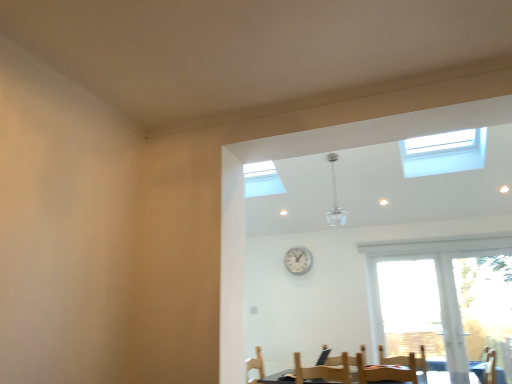
Question: Is silver metallic clock at center smaller than wooden chair at lower center?

Choices:
 (A) yes
 (B) no

Answer: (A)

Question: Could you tell me if silver metallic clock at center is turned towards wooden chair at lower center?

Choices:
 (A) yes
 (B) no

Answer: (B)

Question: Is silver metallic clock at center far away from wooden chair at lower center?

Choices:
 (A) yes
 (B) no

Answer: (A)

Question: Is wooden chair at lower center at the back of silver metallic clock at center?

Choices:
 (A) no
 (B) yes

Answer: (A)

Question: Is silver metallic clock at center at the left side of wooden chair at lower center?

Choices:
 (A) yes
 (B) no

Answer: (A)

Question: Is point (295, 246) closer or farther from the camera than point (410, 374)?

Choices:
 (A) closer
 (B) farther

Answer: (B)

Question: In terms of size, does silver metallic clock at center appear bigger or smaller than wooden chair at lower center?

Choices:
 (A) big
 (B) small

Answer: (B)

Question: Is silver metallic clock at center inside or outside of wooden chair at lower center?

Choices:
 (A) inside
 (B) outside

Answer: (B)

Question: In terms of width, does silver metallic clock at center look wider or thinner when compared to wooden chair at lower center?

Choices:
 (A) thin
 (B) wide

Answer: (A)

Question: Would you say wooden chair at lower center is inside or outside wooden armchair at lower right?

Choices:
 (A) inside
 (B) outside

Answer: (B)

Question: Visually, is wooden chair at lower center positioned to the left or to the right of wooden armchair at lower right?

Choices:
 (A) left
 (B) right

Answer: (A)

Question: Is point (359, 380) positioned closer to the camera than point (381, 360)?

Choices:
 (A) closer
 (B) farther

Answer: (A)

Question: From a real-world perspective, relative to wooden armchair at lower right, is wooden chair at lower center vertically above or below?

Choices:
 (A) above
 (B) below

Answer: (B)

Question: From their relative heights in the image, would you say silver metallic clock at center is taller or shorter than wooden armchair at lower right?

Choices:
 (A) short
 (B) tall

Answer: (B)

Question: From the image's perspective, relative to wooden armchair at lower right, is silver metallic clock at center above or below?

Choices:
 (A) above
 (B) below

Answer: (A)